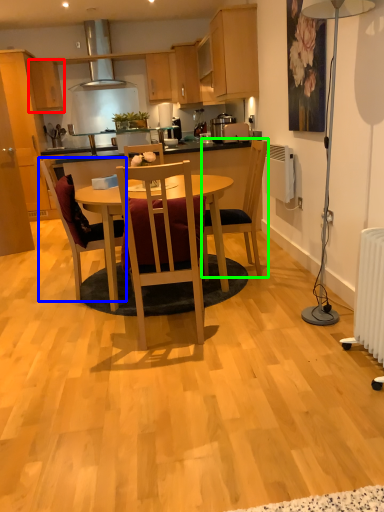
Question: Which object is the closest to the cabinetry (highlighted by a red box)? Choose among these: chair (highlighted by a blue box) or chair (highlighted by a green box).

Choices:
 (A) chair
 (B) chair

Answer: (A)